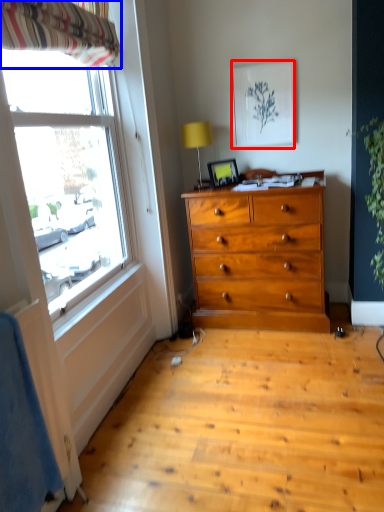
Question: Which object appears closest to the camera in this image, picture frame (highlighted by a red box) or curtain (highlighted by a blue box)?

Choices:
 (A) picture frame
 (B) curtain

Answer: (B)